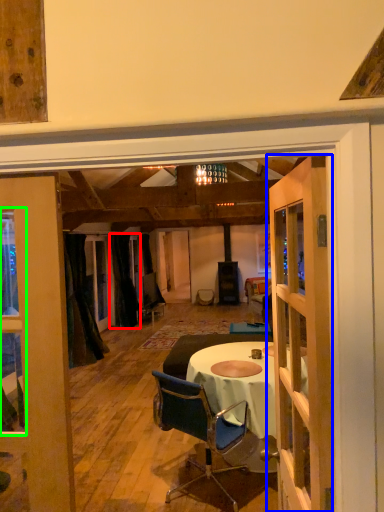
Question: Which is farther away from curtain (highlighted by a red box)? door (highlighted by a blue box) or window (highlighted by a green box)?

Choices:
 (A) door
 (B) window

Answer: (A)